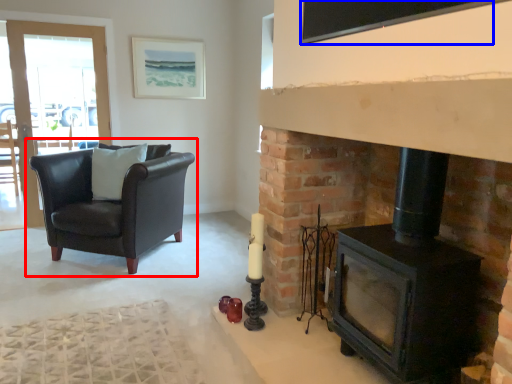
Question: Which point is closer to the camera, chair (highlighted by a red box) or window screen (highlighted by a blue box)?

Choices:
 (A) chair
 (B) window screen

Answer: (B)